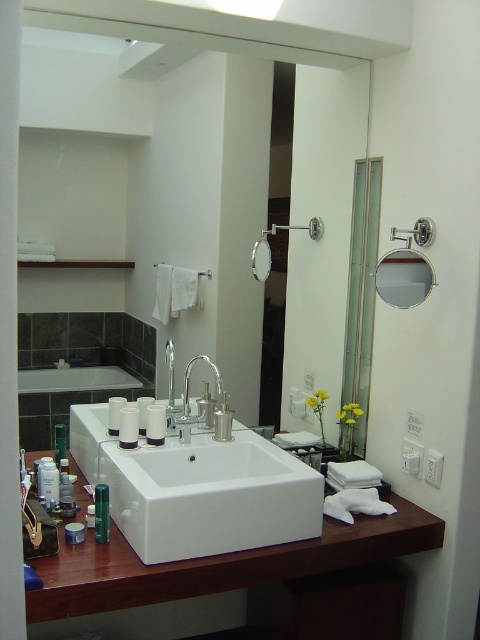
Does white ceramic sink at center have a lesser height compared to white glossy countertop at center?

In fact, white ceramic sink at center may be taller than white glossy countertop at center.

Which is in front, point (216, 456) or point (312, 552)?

Point (312, 552) is more forward.

Is point (288, 464) in front of point (277, 572)?

No.

The height and width of the screenshot is (640, 480). I want to click on white ceramic sink at center, so click(210, 497).

Does white glossy countertop at center appear over matte silver mirror at upper right?

Actually, white glossy countertop at center is below matte silver mirror at upper right.

This screenshot has height=640, width=480. Describe the element at coordinates (216, 564) in the screenshot. I see `white glossy countertop at center` at that location.

What are the coordinates of `white glossy countertop at center` in the screenshot? It's located at (216, 564).

Which is above, white ceramic sink at center or matte silver mirror at upper right?

Positioned higher is matte silver mirror at upper right.

Who is positioned more to the left, white ceramic sink at center or matte silver mirror at upper right?

From the viewer's perspective, white ceramic sink at center appears more on the left side.

This screenshot has width=480, height=640. I want to click on white ceramic sink at center, so click(x=210, y=497).

The width and height of the screenshot is (480, 640). Find the location of `white ceramic sink at center`. white ceramic sink at center is located at coordinates (210, 497).